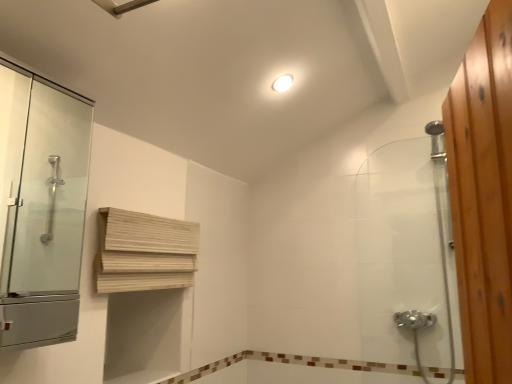
Question: Does white glossy light fixture at upper center lie behind clear glass shower door at right?

Choices:
 (A) no
 (B) yes

Answer: (B)

Question: Is white glossy light fixture at upper center facing away from clear glass shower door at right?

Choices:
 (A) yes
 (B) no

Answer: (B)

Question: Can you confirm if white glossy light fixture at upper center is taller than clear glass shower door at right?

Choices:
 (A) no
 (B) yes

Answer: (A)

Question: Does white glossy light fixture at upper center have a lesser width compared to clear glass shower door at right?

Choices:
 (A) yes
 (B) no

Answer: (A)

Question: From the image's perspective, is white glossy light fixture at upper center below clear glass shower door at right?

Choices:
 (A) no
 (B) yes

Answer: (A)

Question: From a real-world perspective, is white glossy light fixture at upper center over clear glass shower door at right?

Choices:
 (A) yes
 (B) no

Answer: (A)

Question: Is clear glass shower door at right not inside brown mosaic tile at lower center?

Choices:
 (A) yes
 (B) no

Answer: (A)

Question: Can you confirm if clear glass shower door at right is shorter than brown mosaic tile at lower center?

Choices:
 (A) no
 (B) yes

Answer: (A)

Question: From the image's perspective, does clear glass shower door at right appear lower than brown mosaic tile at lower center?

Choices:
 (A) no
 (B) yes

Answer: (A)

Question: Are clear glass shower door at right and brown mosaic tile at lower center far apart?

Choices:
 (A) yes
 (B) no

Answer: (B)

Question: Is clear glass shower door at right taller than brown mosaic tile at lower center?

Choices:
 (A) yes
 (B) no

Answer: (A)

Question: Is clear glass shower door at right smaller than brown mosaic tile at lower center?

Choices:
 (A) no
 (B) yes

Answer: (A)

Question: Is transparent glass shower door at left outside of brown mosaic tile at lower center?

Choices:
 (A) no
 (B) yes

Answer: (B)